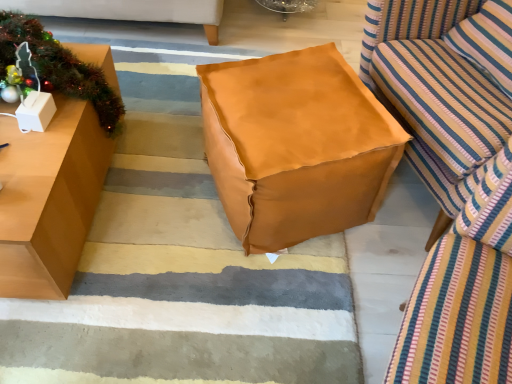
Question: In the image, is white cardboard box at left positioned in front of or behind striped fabric studio couch at right?

Choices:
 (A) behind
 (B) front

Answer: (A)

Question: Is point pyautogui.click(x=39, y=102) positioned closer to the camera than point pyautogui.click(x=434, y=125)?

Choices:
 (A) farther
 (B) closer

Answer: (B)

Question: Which object is positioned farthest from the striped fabric studio couch at right?

Choices:
 (A) white cardboard box at left
 (B) matte brown table at left
 (C) metallic green garland at left
 (D) brown leather ottoman at center
 (E) leather-like tan bean bag at center

Answer: (A)

Question: Which is nearer to the striped fabric pillow at right?

Choices:
 (A) brown leather ottoman at center
 (B) metallic green garland at left
 (C) leather-like tan bean bag at center
 (D) white cardboard box at left
 (E) matte brown table at left

Answer: (C)